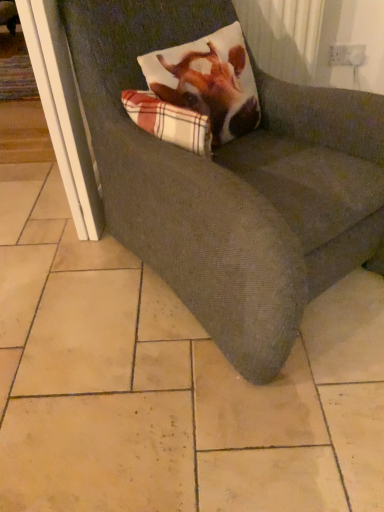
Locate an element on the screen. free spot in front of white plastic screen door at left is located at coordinates (72, 265).